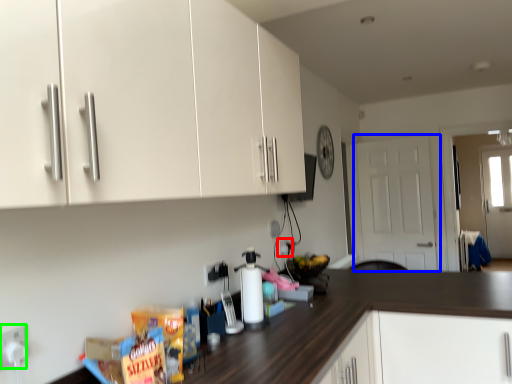
Question: Based on their relative distances, which object is farther from electric outlet (highlighted by a red box)? Choose from door (highlighted by a blue box) and electric outlet (highlighted by a green box).

Choices:
 (A) door
 (B) electric outlet

Answer: (A)